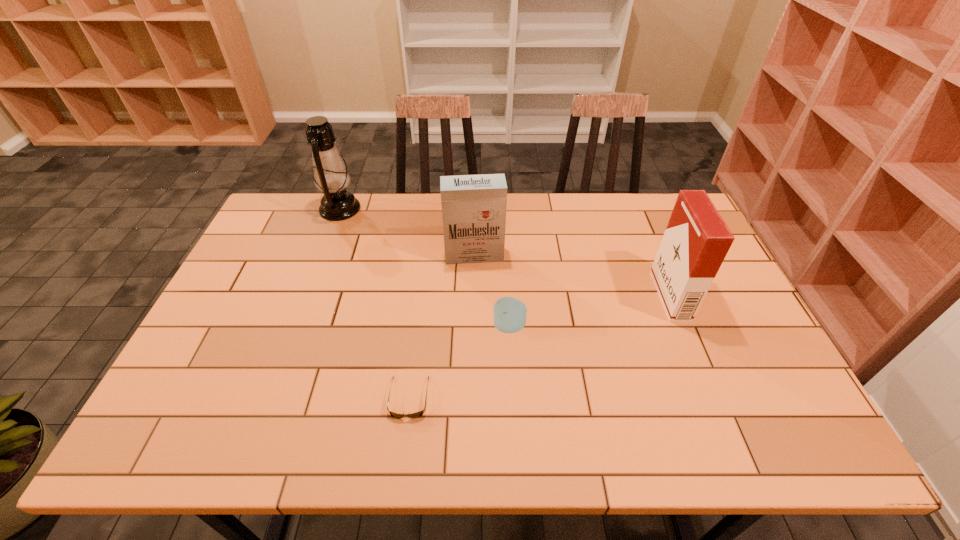
At what (x,y) coordinates should I click in order to perform the action: click on object located at the far left corner. Please return your answer as a coordinate pair (x, y). The width and height of the screenshot is (960, 540). Looking at the image, I should click on (330, 174).

Image resolution: width=960 pixels, height=540 pixels. I want to click on vacant region at the far edge of the desktop, so click(x=412, y=227).

Where is `vacant space at the near edge of the desktop`? vacant space at the near edge of the desktop is located at coordinates (323, 426).

Identify the location of vacant area at the right edge. Image resolution: width=960 pixels, height=540 pixels. (660, 239).

Image resolution: width=960 pixels, height=540 pixels. I want to click on vacant space at the far left corner, so click(x=281, y=227).

At what (x,y) coordinates should I click in order to perform the action: click on vacant area at the far right corner of the desktop. Please return your answer as a coordinate pair (x, y). This screenshot has height=540, width=960. Looking at the image, I should click on (671, 211).

Locate an element on the screen. free space between the farther cigarette case and the oil lamp is located at coordinates (407, 232).

This screenshot has height=540, width=960. What are the coordinates of `unoccupied position between the second farthest object and the second shortest object` in the screenshot? It's located at (492, 291).

I want to click on vacant space that is in between the shortest object and the farthest object, so click(x=374, y=303).

I want to click on vacant point located between the leftmost object and the apple, so click(x=424, y=268).